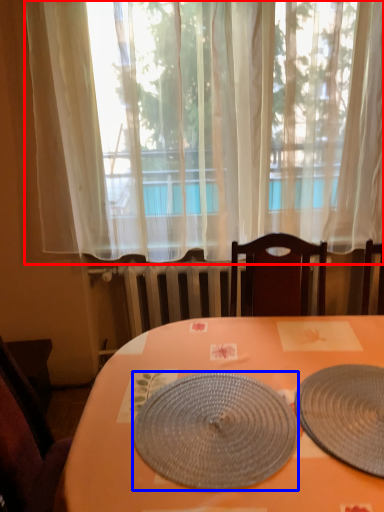
Question: Which of the following is the farthest to the observer, curtain (highlighted by a red box) or plate (highlighted by a blue box)?

Choices:
 (A) curtain
 (B) plate

Answer: (A)